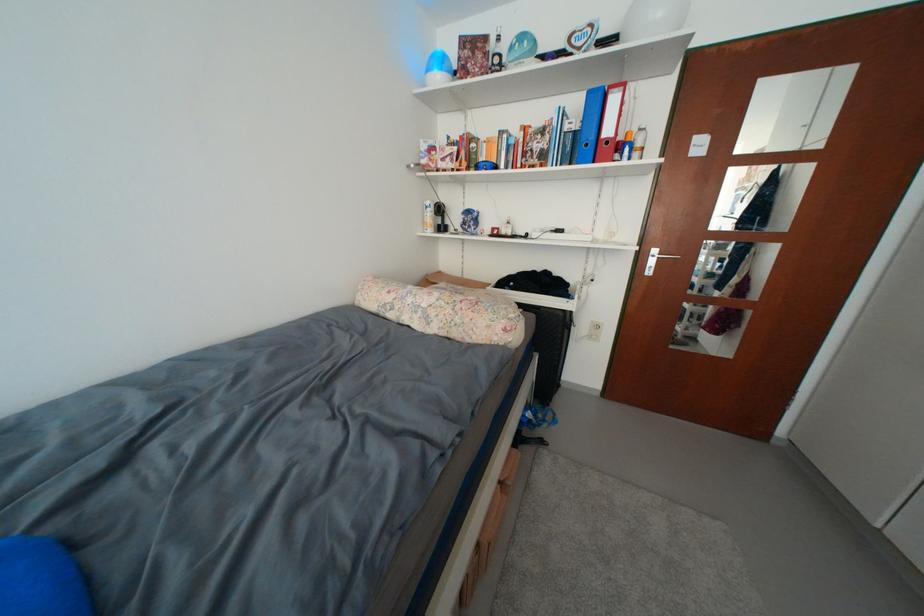
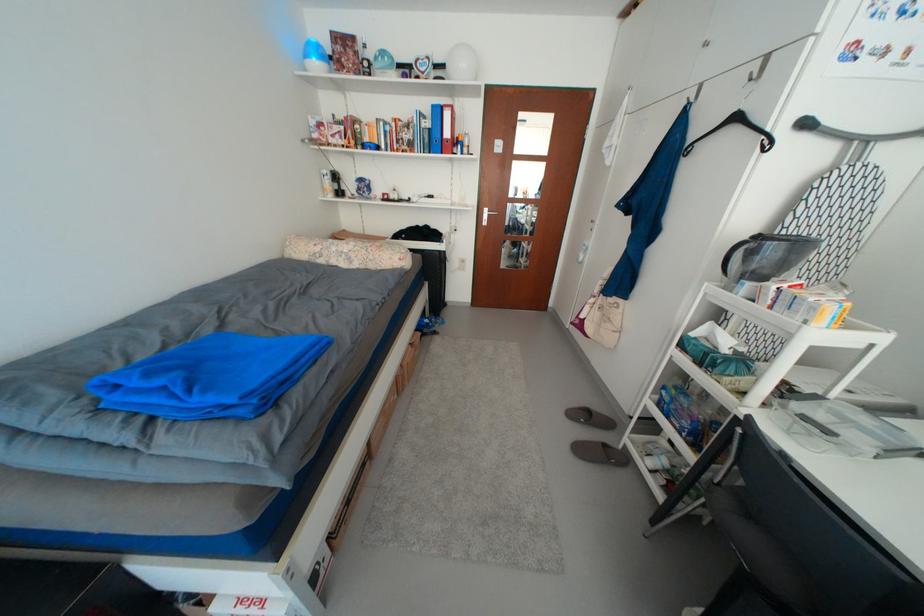
Question: The camera is either moving clockwise (left) or counter-clockwise (right) around the object. The first image is from the beginning of the video and the second image is from the end. Is the camera moving left or right when shooting the video?

Choices:
 (A) Left
 (B) Right

Answer: (A)